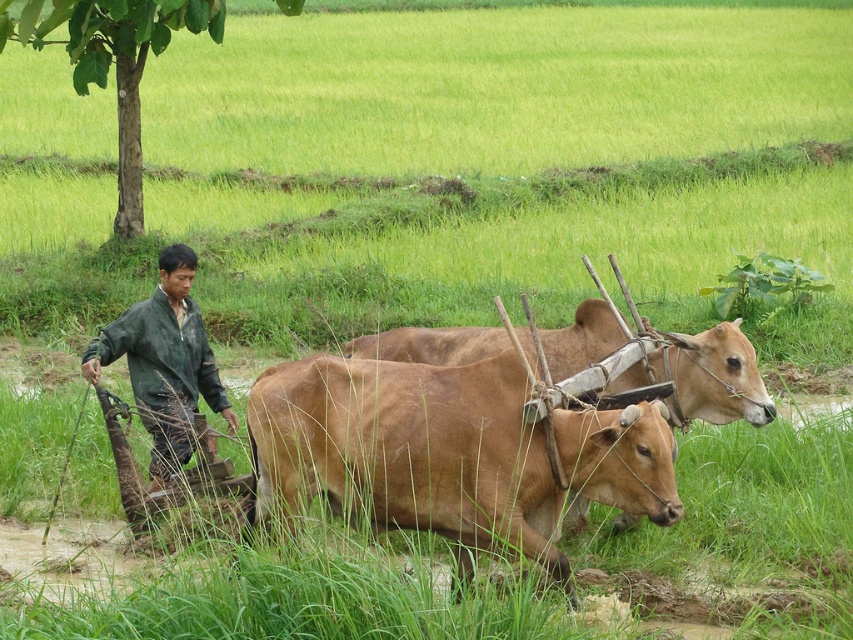
Question: Which point is closer to the camera taking this photo?

Choices:
 (A) click(477, 413)
 (B) click(108, 358)

Answer: (A)

Question: Which point is farther to the camera?

Choices:
 (A) brown smooth cow at center
 (B) green matte jacket at left

Answer: (B)

Question: Does brown smooth cow at center lie in front of green matte jacket at left?

Choices:
 (A) no
 (B) yes

Answer: (B)

Question: Is brown smooth cow at center wider than green matte jacket at left?

Choices:
 (A) yes
 (B) no

Answer: (A)

Question: Is brown smooth cow at center to the left of green matte jacket at left from the viewer's perspective?

Choices:
 (A) no
 (B) yes

Answer: (A)

Question: Which point is closer to the camera?

Choices:
 (A) green matte jacket at left
 (B) brown smooth cow at center

Answer: (B)